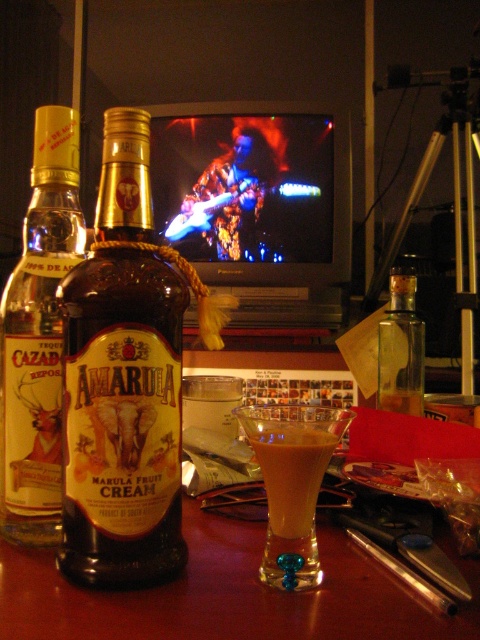
Is golden creamy cocktail at center positioned at the back of brown creamy liquid at center?

No.

Who is shorter, golden creamy cocktail at center or brown creamy liquid at center?

brown creamy liquid at center

Image resolution: width=480 pixels, height=640 pixels. What do you see at coordinates (291, 483) in the screenshot?
I see `golden creamy cocktail at center` at bounding box center [291, 483].

This screenshot has height=640, width=480. In order to click on golden creamy cocktail at center in this screenshot , I will do `click(291, 483)`.

Does amber glass bottle at center have a greater width compared to translucent amber glass bottle at center-left?

Indeed, amber glass bottle at center has a greater width compared to translucent amber glass bottle at center-left.

How distant is amber glass bottle at center from translucent amber glass bottle at center-left?

amber glass bottle at center is 2.44 inches from translucent amber glass bottle at center-left.

From the picture: Who is more forward, (164,573) or (23,408)?

Point (164,573) is in front.

This screenshot has width=480, height=640. Find the location of `amber glass bottle at center`. amber glass bottle at center is located at coordinates (122, 381).

Is point (347, 413) more distant than point (403, 387)?

No, it is not.

You are a GUI agent. You are given a task and a screenshot of the screen. Output one action in this format:
    pyautogui.click(x=<x>, y=<y>)
    Task: Click on the golden creamy cocktail at center
    Image resolution: width=480 pixels, height=640 pixels.
    Given the screenshot: What is the action you would take?
    pyautogui.click(x=291, y=483)

I want to click on golden creamy cocktail at center, so click(291, 483).

Locate an element on the screen. The image size is (480, 640). golden creamy cocktail at center is located at coordinates (291, 483).